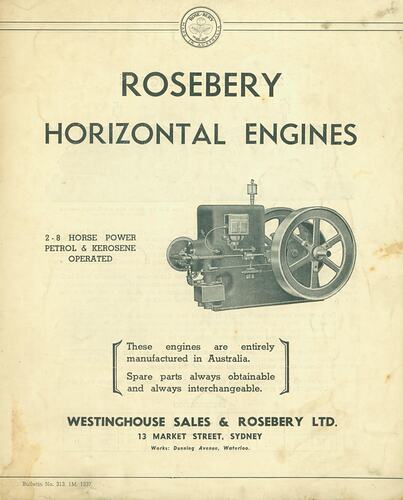
Identify the location of stains. This screenshot has width=403, height=500. (30, 463), (385, 376), (311, 410).